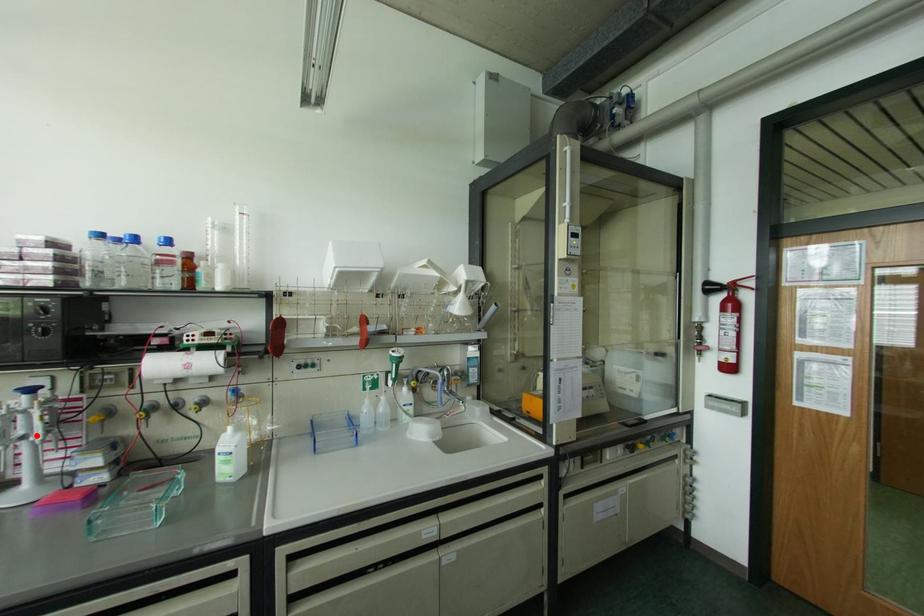
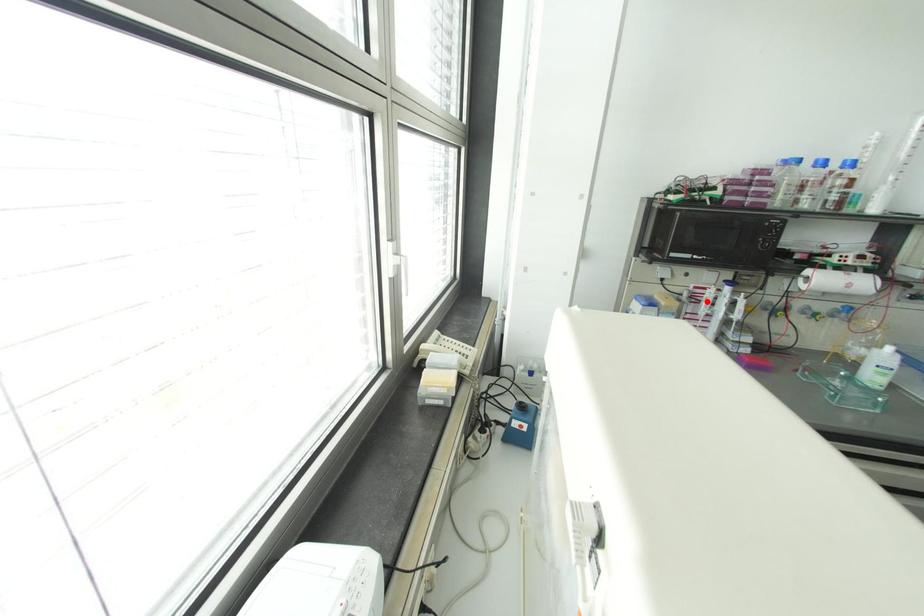
I am providing you with two images of the same scene from different viewpoints. A red point is marked on the first image and another point is marked on the second image. Are the points marked in image1 and image2 representing the same 3D position?

No